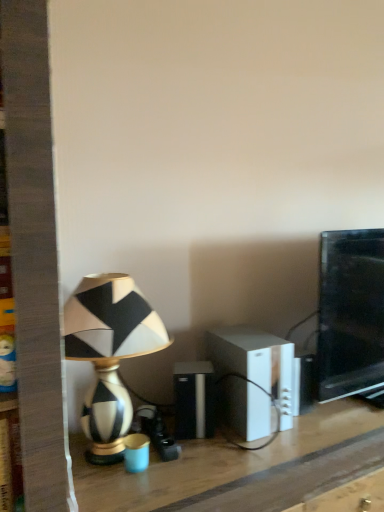
This screenshot has width=384, height=512. In order to click on free point in front of white plastic speaker at center, which is the 2th speaker from left to right in this screenshot , I will do `click(249, 458)`.